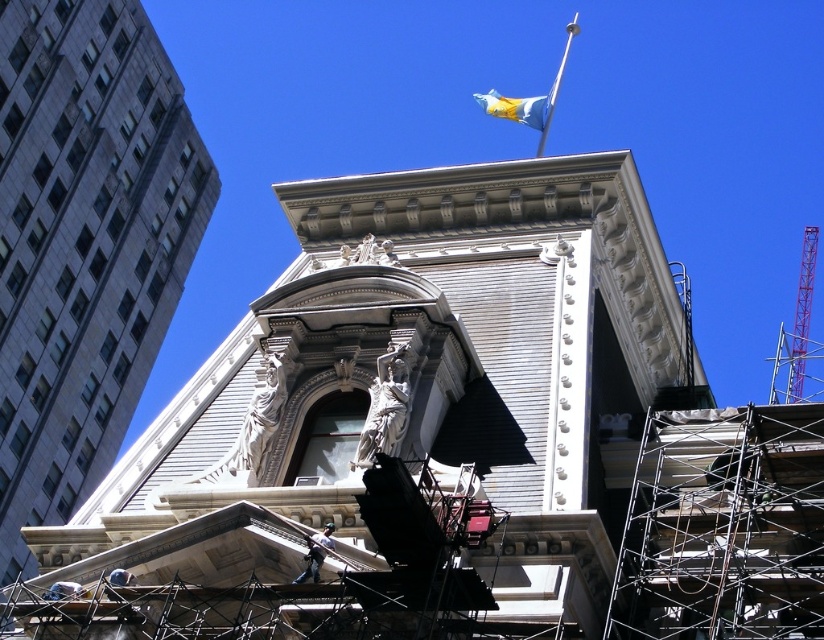
Does blue fabric flag at upper center have a smaller size compared to silver metallic flag pole at upper center?

Correct, blue fabric flag at upper center occupies less space than silver metallic flag pole at upper center.

Is blue fabric flag at upper center bigger than silver metallic flag pole at upper center?

Incorrect, blue fabric flag at upper center is not larger than silver metallic flag pole at upper center.

Who is more distant from viewer, [516,102] or [546,125]?

Positioned behind is point [516,102].

You are a GUI agent. You are given a task and a screenshot of the screen. Output one action in this format:
    pyautogui.click(x=<x>, y=<y>)
    Task: Click on the blue fabric flag at upper center
    
    Given the screenshot: What is the action you would take?
    pyautogui.click(x=517, y=108)

Based on the photo, is smooth gray stone tower at center positioned before blue fabric flag at upper center?

Yes.

Who is more forward, (148, 614) or (488, 96)?

Point (148, 614)

Locate an element on the screen. Image resolution: width=824 pixels, height=640 pixels. smooth gray stone tower at center is located at coordinates (398, 422).

The height and width of the screenshot is (640, 824). What do you see at coordinates (398, 422) in the screenshot?
I see `smooth gray stone tower at center` at bounding box center [398, 422].

Can you confirm if smooth gray stone tower at center is positioned below gray stone building at upper left?

Yes.

This screenshot has height=640, width=824. Find the location of `smooth gray stone tower at center`. smooth gray stone tower at center is located at coordinates (398, 422).